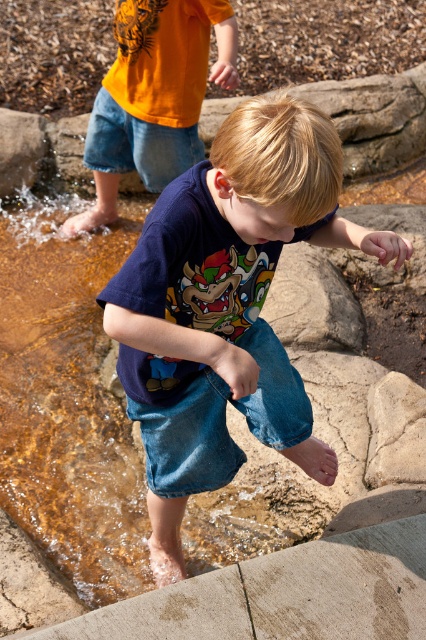
You are a photographer trying to capture a candid shot of the two children playing near the water feature. You notice the denim shorts at upper left and denim jeans at upper center in your frame. Which piece of clothing is located to the right of the other?

The denim shorts at upper left is positioned on the right side of denim jeans at upper center.

You are a photographer standing at the edge of the water feature. You want to take a photo that includes both the denim shorts at upper left and the denim jeans at lower center. What is the minimum distance you need to move backward to ensure both objects are fully visible in the frame?

The denim shorts at upper left is 2.18 meters from denim jeans at lower center. To capture both in the frame, you need to move back at least 2.18 meters to accommodate the distance between them.